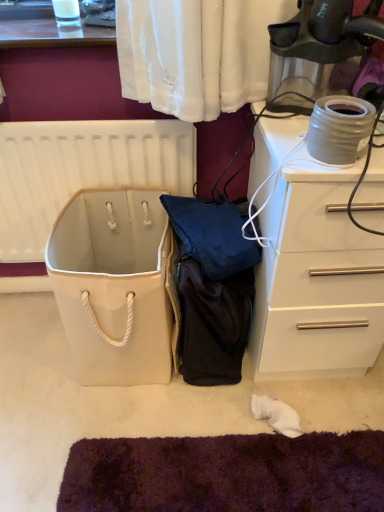
Question: From a real-world perspective, relative to white canvas bag at center, is white glossy chest of drawers at right vertically above or below?

Choices:
 (A) above
 (B) below

Answer: (A)

Question: Is white glossy chest of drawers at right spatially inside white canvas bag at center, or outside of it?

Choices:
 (A) inside
 (B) outside

Answer: (B)

Question: Which object is the farthest from the white plastic radiator at upper left?

Choices:
 (A) white canvas bag at center
 (B) matte gray ceramic pot at upper right
 (C) white glossy chest of drawers at right

Answer: (B)

Question: Considering the real-world distances, which object is farthest from the matte gray ceramic pot at upper right?

Choices:
 (A) white plastic radiator at upper left
 (B) white canvas bag at center
 (C) white glossy chest of drawers at right

Answer: (A)